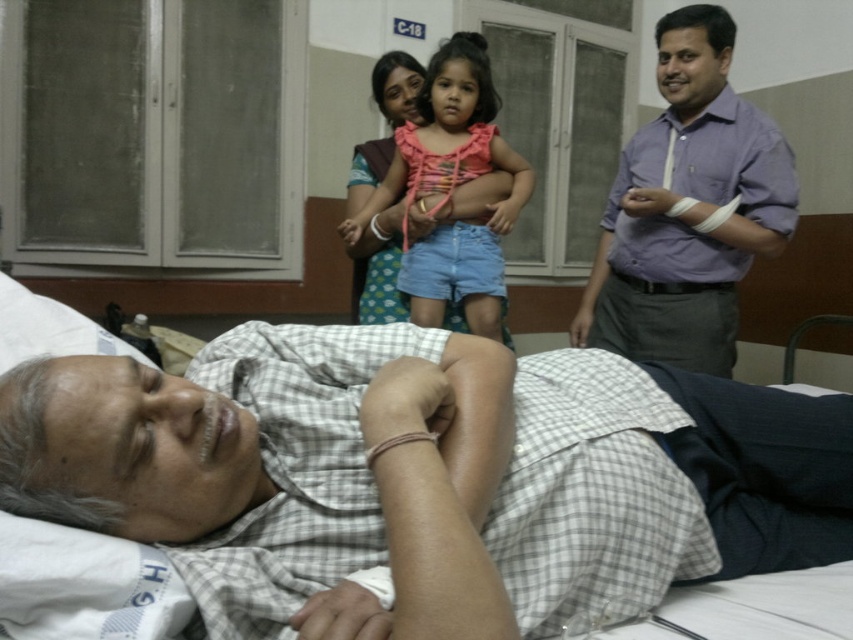
Question: Is pink fabric dress at center wider than brown fabric dress at upper center?

Choices:
 (A) no
 (B) yes

Answer: (B)

Question: Which object is the farthest from the checkered fabric shirt at center?

Choices:
 (A) pink fabric dress at center
 (B) brown fabric dress at upper center
 (C) purple cotton shirt at right

Answer: (B)

Question: Which object is the closest to the purple cotton shirt at right?

Choices:
 (A) pink fabric dress at center
 (B) brown fabric dress at upper center
 (C) checkered fabric shirt at center

Answer: (A)

Question: Can you confirm if checkered fabric shirt at center is positioned below purple cotton shirt at right?

Choices:
 (A) yes
 (B) no

Answer: (A)

Question: Can you confirm if checkered fabric shirt at center is bigger than brown fabric dress at upper center?

Choices:
 (A) yes
 (B) no

Answer: (A)

Question: Estimate the real-world distances between objects in this image. Which object is farther from the pink fabric dress at center?

Choices:
 (A) checkered fabric shirt at center
 (B) brown fabric dress at upper center
 (C) purple cotton shirt at right

Answer: (A)